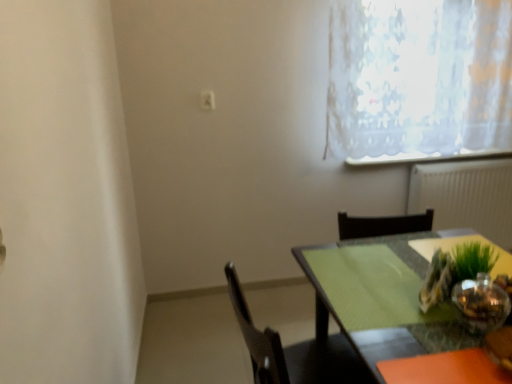
Locate an element on the screen. This screenshot has width=512, height=384. blank space above green matte table at lower right (from a real-world perspective) is located at coordinates (395, 298).